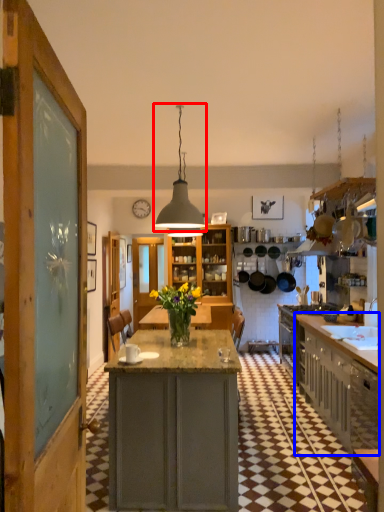
Question: Which object is closer to the camera taking this photo, light fixture (highlighted by a red box) or cabinetry (highlighted by a blue box)?

Choices:
 (A) light fixture
 (B) cabinetry

Answer: (A)